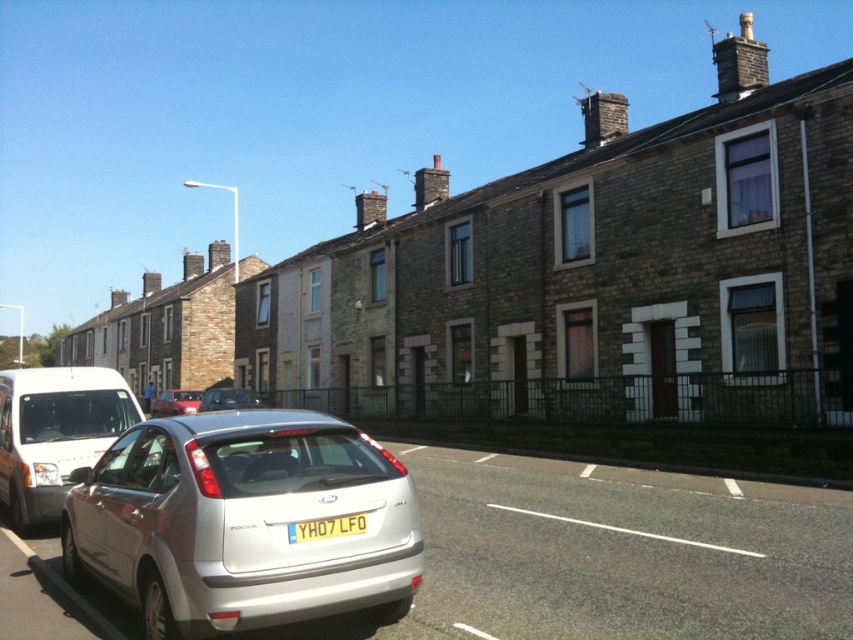
Between silver metallic hatchback at left and metallic silver sedan at center, which one has more height?

With more height is silver metallic hatchback at left.

Find the location of `silver metallic hatchback at left`. silver metallic hatchback at left is located at coordinates (55, 433).

Find the location of a particular element. Image resolution: width=853 pixels, height=640 pixels. silver metallic hatchback at left is located at coordinates (55, 433).

Is silver metallic hatchback at lower left thinner than metallic silver sedan at center?

Correct, silver metallic hatchback at lower left's width is less than metallic silver sedan at center's.

What do you see at coordinates (242, 522) in the screenshot?
I see `silver metallic hatchback at lower left` at bounding box center [242, 522].

Locate an element on the screen. This screenshot has width=853, height=640. silver metallic hatchback at lower left is located at coordinates (242, 522).

Is the position of yellow matte license plate at center more distant than that of metallic red car at lower left?

No, yellow matte license plate at center is closer to the viewer.

Which is behind, point (363, 516) or point (171, 396)?

The point (171, 396) is more distant.

This screenshot has height=640, width=853. I want to click on yellow matte license plate at center, so click(326, 528).